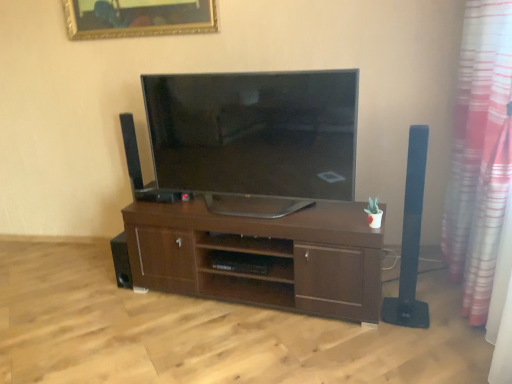
I want to click on free region under satin black tv at center (from a real-world perspective), so click(266, 213).